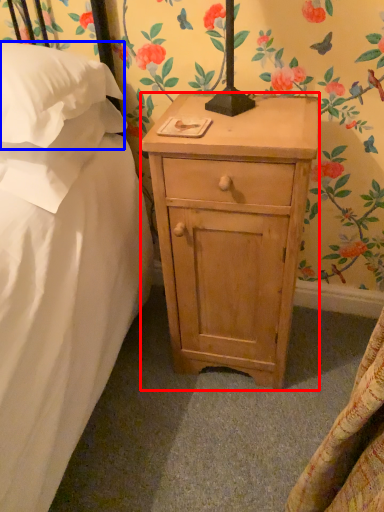
Question: Among these objects, which one is nearest to the camera, nightstand (highlighted by a red box) or pillow (highlighted by a blue box)?

Choices:
 (A) nightstand
 (B) pillow

Answer: (B)